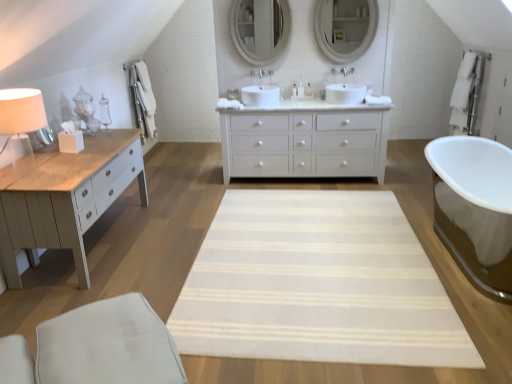
Question: Is white ceramic faucet at center, which is the first faucet from right to left, in contact with white fabric swivel chair at lower left?

Choices:
 (A) yes
 (B) no

Answer: (B)

Question: Considering the relative sizes of white ceramic faucet at center, the second faucet when ordered from left to right, and white fabric swivel chair at lower left in the image provided, is white ceramic faucet at center, the second faucet when ordered from left to right, wider than white fabric swivel chair at lower left?

Choices:
 (A) no
 (B) yes

Answer: (A)

Question: Does white ceramic faucet at center, which is the first faucet from right to left, have a smaller size compared to white fabric swivel chair at lower left?

Choices:
 (A) yes
 (B) no

Answer: (A)

Question: From a real-world perspective, is white ceramic faucet at center, the second faucet when ordered from left to right, physically below white fabric swivel chair at lower left?

Choices:
 (A) no
 (B) yes

Answer: (A)

Question: Is white ceramic faucet at center, which is the first faucet from right to left, located outside white fabric swivel chair at lower left?

Choices:
 (A) yes
 (B) no

Answer: (A)

Question: From their relative heights in the image, would you say white painted wood chest of drawers at center is taller or shorter than white ceramic faucet at center, the 1th faucet viewed from the left?

Choices:
 (A) short
 (B) tall

Answer: (B)

Question: From the image's perspective, is white painted wood chest of drawers at center above or below white ceramic faucet at center, placed as the 2th faucet when sorted from right to left?

Choices:
 (A) above
 (B) below

Answer: (B)

Question: Would you say white painted wood chest of drawers at center is to the left or to the right of white ceramic faucet at center, the 1th faucet viewed from the left, in the picture?

Choices:
 (A) left
 (B) right

Answer: (B)

Question: Is point (352, 114) closer or farther from the camera than point (261, 76)?

Choices:
 (A) closer
 (B) farther

Answer: (A)

Question: Do you think white ceramic faucet at center, which is the first faucet from right to left, is within white fabric swivel chair at lower left, or outside of it?

Choices:
 (A) outside
 (B) inside

Answer: (A)

Question: Considering the positions of white ceramic faucet at center, which is the first faucet from right to left, and white fabric swivel chair at lower left in the image, is white ceramic faucet at center, which is the first faucet from right to left, bigger or smaller than white fabric swivel chair at lower left?

Choices:
 (A) big
 (B) small

Answer: (B)

Question: Considering the positions of white ceramic faucet at center, the second faucet when ordered from left to right, and white fabric swivel chair at lower left in the image, is white ceramic faucet at center, the second faucet when ordered from left to right, taller or shorter than white fabric swivel chair at lower left?

Choices:
 (A) short
 (B) tall

Answer: (A)

Question: From the image's perspective, is white ceramic faucet at center, which is the first faucet from right to left, positioned above or below white fabric swivel chair at lower left?

Choices:
 (A) above
 (B) below

Answer: (A)

Question: Considering their positions, is white painted wood chest of drawers at center located in front of or behind white fabric swivel chair at lower left?

Choices:
 (A) front
 (B) behind

Answer: (B)

Question: Is point [308, 145] closer or farther from the camera than point [117, 362]?

Choices:
 (A) farther
 (B) closer

Answer: (A)